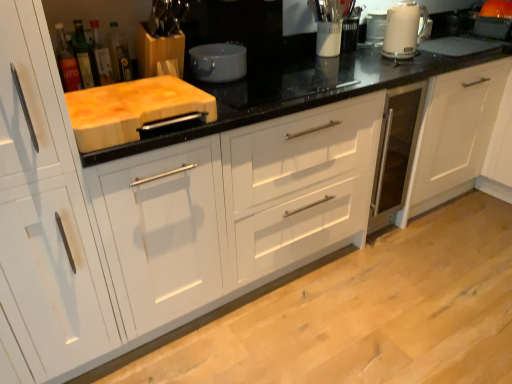
Question: Is translucent glass bottle at upper left, which ranks as the fourth bottle in right-to-left order, smaller than green glass bottle at upper left, placed as the 2th bottle when sorted from left to right?

Choices:
 (A) yes
 (B) no

Answer: (A)

Question: Is the surface of translucent glass bottle at upper left, which is the first bottle in left-to-right order, in direct contact with green glass bottle at upper left, the 3th bottle when ordered from right to left?

Choices:
 (A) no
 (B) yes

Answer: (B)

Question: Is translucent glass bottle at upper left, which is the first bottle in left-to-right order, shorter than green glass bottle at upper left, the 3th bottle when ordered from right to left?

Choices:
 (A) yes
 (B) no

Answer: (A)

Question: Is translucent glass bottle at upper left, which ranks as the fourth bottle in right-to-left order, bigger than green glass bottle at upper left, the 3th bottle when ordered from right to left?

Choices:
 (A) no
 (B) yes

Answer: (A)

Question: Is translucent glass bottle at upper left, which is the first bottle in left-to-right order, taller than green glass bottle at upper left, placed as the 2th bottle when sorted from left to right?

Choices:
 (A) yes
 (B) no

Answer: (B)

Question: Considering the positions of natural wood cutting board at left and translucent glass bottle at upper left, placed as the fourth bottle when sorted from left to right, in the image, is natural wood cutting board at left bigger or smaller than translucent glass bottle at upper left, placed as the fourth bottle when sorted from left to right,?

Choices:
 (A) big
 (B) small

Answer: (A)

Question: Looking at their shapes, would you say natural wood cutting board at left is wider or thinner than translucent glass bottle at upper left, arranged as the first bottle when viewed from the right?

Choices:
 (A) wide
 (B) thin

Answer: (A)

Question: From the image's perspective, relative to translucent glass bottle at upper left, placed as the fourth bottle when sorted from left to right, is natural wood cutting board at left above or below?

Choices:
 (A) below
 (B) above

Answer: (A)

Question: From a real-world perspective, is natural wood cutting board at left above or below translucent glass bottle at upper left, arranged as the first bottle when viewed from the right?

Choices:
 (A) above
 (B) below

Answer: (B)

Question: Based on their sizes in the image, would you say white glossy kettle at upper right is bigger or smaller than translucent glass bottle at upper left, which ranks as the fourth bottle in right-to-left order?

Choices:
 (A) big
 (B) small

Answer: (A)

Question: Which is correct: white glossy kettle at upper right is inside translucent glass bottle at upper left, which is the first bottle in left-to-right order, or outside of it?

Choices:
 (A) inside
 (B) outside

Answer: (B)

Question: Is point (377, 13) closer or farther from the camera than point (62, 23)?

Choices:
 (A) farther
 (B) closer

Answer: (A)

Question: From a real-world perspective, is white glossy kettle at upper right above or below translucent glass bottle at upper left, which ranks as the fourth bottle in right-to-left order?

Choices:
 (A) above
 (B) below

Answer: (B)

Question: From a real-world perspective, is translucent glass bottle at upper left, which ranks as the fourth bottle in right-to-left order, positioned above or below translucent glass bottle at upper left, arranged as the first bottle when viewed from the right?

Choices:
 (A) above
 (B) below

Answer: (A)

Question: Which is correct: translucent glass bottle at upper left, which ranks as the fourth bottle in right-to-left order, is inside translucent glass bottle at upper left, placed as the fourth bottle when sorted from left to right, or outside of it?

Choices:
 (A) inside
 (B) outside

Answer: (B)